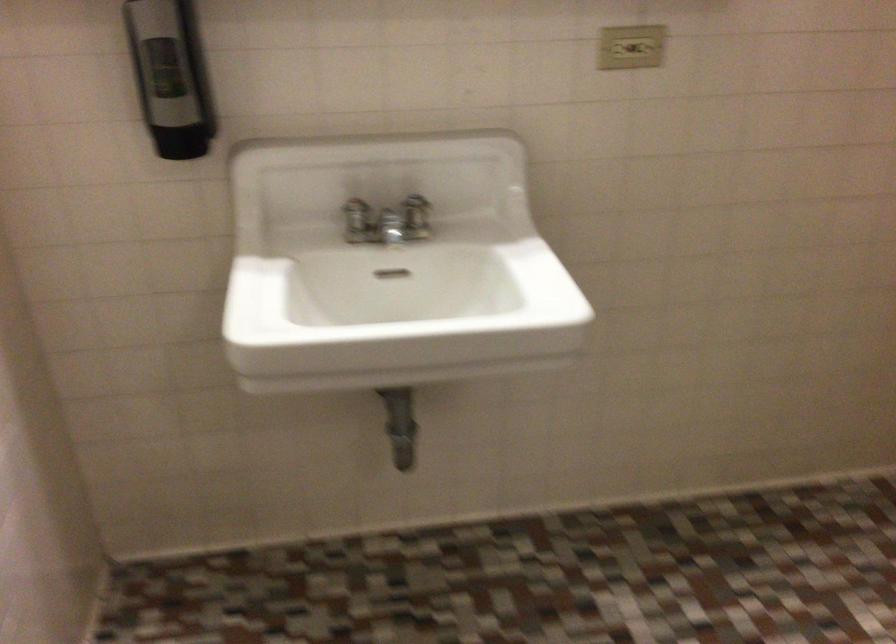
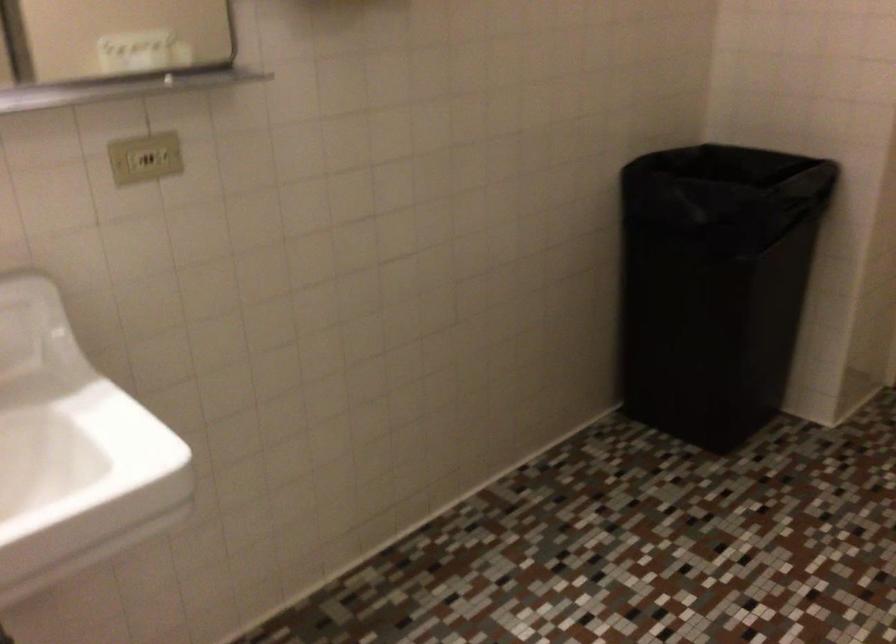
Question: The images are taken continuously from a first-person perspective. In which direction is your viewpoint rotating?

Choices:
 (A) Left
 (B) Right
 (C) Up
 (D) Down

Answer: (B)